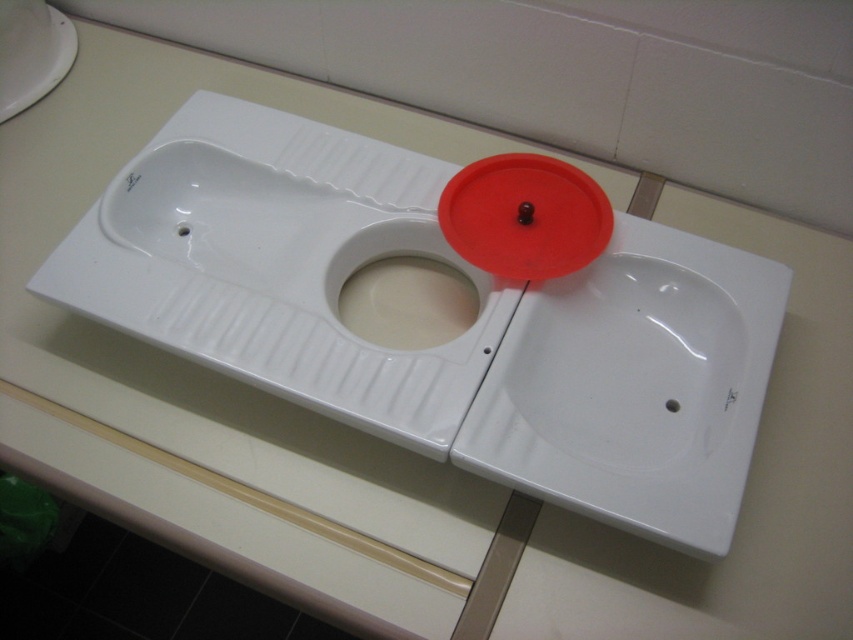
Question: Is white glossy sink at center smaller than red matte lid at center?

Choices:
 (A) no
 (B) yes

Answer: (A)

Question: In this image, where is white glossy sink at center located relative to red matte lid at center?

Choices:
 (A) below
 (B) above

Answer: (A)

Question: Which of the following is the closest to the observer?

Choices:
 (A) (666, 540)
 (B) (515, 234)

Answer: (A)

Question: Which of the following is the farthest from the observer?

Choices:
 (A) (550, 195)
 (B) (306, 403)

Answer: (A)

Question: In this image, where is white glossy sink at center located relative to red matte lid at center?

Choices:
 (A) right
 (B) left

Answer: (B)